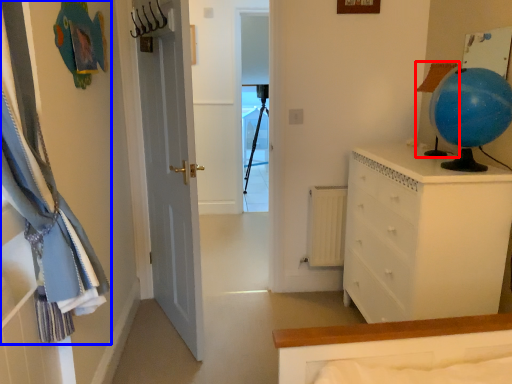
Question: Which object appears closest to the camera in this image, lamp (highlighted by a red box) or curtain (highlighted by a blue box)?

Choices:
 (A) lamp
 (B) curtain

Answer: (B)